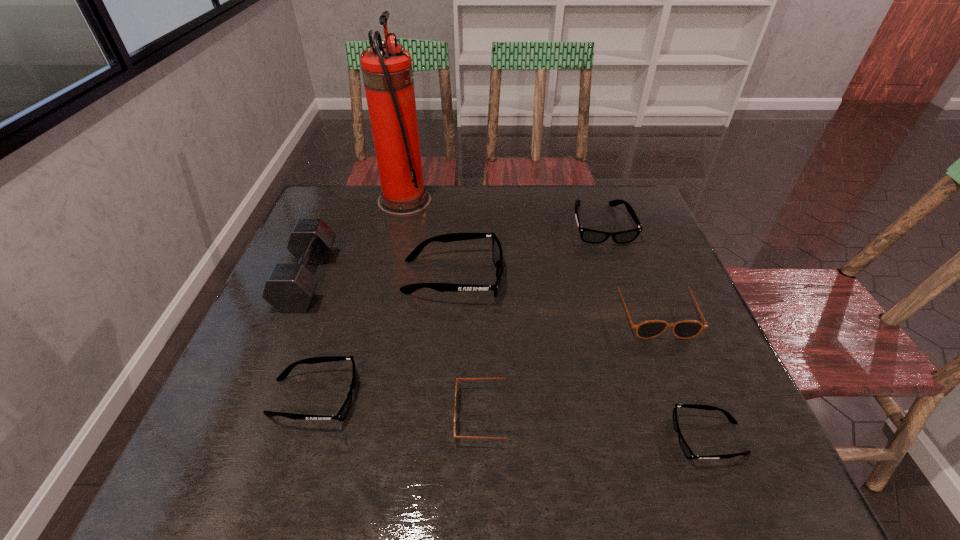
Locate an element on the screen. Image resolution: width=960 pixels, height=540 pixels. unoccupied area between the shortest object and the farther brown sunglasses is located at coordinates (682, 375).

Locate an element on the screen. free point between the dumbbell and the fire extinguisher is located at coordinates (356, 240).

Locate an element on the screen. This screenshot has height=540, width=960. free space that is in between the seventh shortest object and the right brown sunglasses is located at coordinates (481, 295).

Find the location of a particular element. unoccupied area between the third black sunglasses from right to left and the shortest sunglasses is located at coordinates (581, 357).

Where is `vacant point located between the smaller brown sunglasses and the third smallest black sunglasses`? The image size is (960, 540). vacant point located between the smaller brown sunglasses and the third smallest black sunglasses is located at coordinates (544, 320).

You are a GUI agent. You are given a task and a screenshot of the screen. Output one action in this format:
    pyautogui.click(x=<x>, y=<y>)
    Task: Click on the vacant space in between the third nearest black sunglasses and the farthest sunglasses
    
    Given the screenshot: What is the action you would take?
    pyautogui.click(x=527, y=251)

You are a GUI agent. You are given a task and a screenshot of the screen. Output one action in this format:
    pyautogui.click(x=<x>, y=<y>)
    Task: Click on the vacant space in between the farther brown sunglasses and the nearer brown sunglasses
    The height and width of the screenshot is (540, 960).
    Given the screenshot: What is the action you would take?
    pyautogui.click(x=571, y=363)

Find the location of a particular element. This screenshot has width=960, height=540. empty space that is in between the leftmost black sunglasses and the farther brown sunglasses is located at coordinates (484, 354).

Identify the location of vacant region between the third black sunglasses from right to left and the bigger brown sunglasses. [554, 294].

Image resolution: width=960 pixels, height=540 pixels. Identify the location of object that is the second closest to the shortest object. (457, 379).